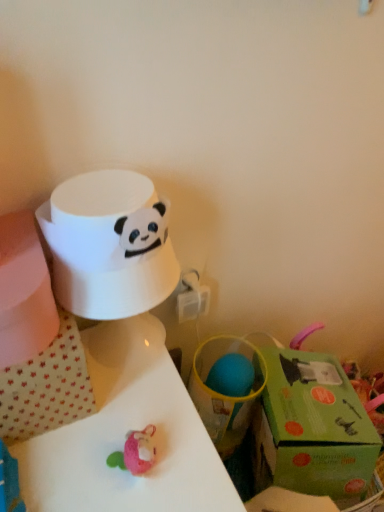
Locate an element on the screen. green cardboard gift box at lower right is located at coordinates (312, 428).

The height and width of the screenshot is (512, 384). What do you see at coordinates (109, 244) in the screenshot?
I see `white matte paper towel at upper left` at bounding box center [109, 244].

Where is `white glossy table at center`? white glossy table at center is located at coordinates (125, 434).

Identify the location of green cardboard gift box at lower right. (x=312, y=428).

Is green cardboard gift box at lower right oriented towards white matte paper towel at upper left?

No, green cardboard gift box at lower right is not oriented towards white matte paper towel at upper left.

Is point (279, 375) positioned in front of point (121, 273)?

That is False.

Does green cardboard gift box at lower right touch white matte paper towel at upper left?

There is a gap between green cardboard gift box at lower right and white matte paper towel at upper left.

Which object is positioned more to the right, green cardboard gift box at lower right or white matte paper towel at upper left?

green cardboard gift box at lower right.

Can you confirm if white glossy table at center is bigger than green cardboard gift box at lower right?

Yes.

From the image's perspective, is white glossy table at center beneath green cardboard gift box at lower right?

Yes, from the image's perspective, white glossy table at center is below green cardboard gift box at lower right.

Can you tell me how much white glossy table at center and green cardboard gift box at lower right differ in facing direction?

They differ by 25.6 degrees in their facing directions.

Is green cardboard gift box at lower right at the back of white glossy table at center?

white glossy table at center is not turned away from green cardboard gift box at lower right.

Is point (128, 191) in front of point (320, 370)?

Yes, point (128, 191) is closer to viewer.

Considering the relative positions of white matte paper towel at upper left and green cardboard gift box at lower right in the image provided, is white matte paper towel at upper left to the right of green cardboard gift box at lower right from the viewer's perspective?

In fact, white matte paper towel at upper left is to the left of green cardboard gift box at lower right.

Is white matte paper towel at upper left further to camera compared to green cardboard gift box at lower right?

No, white matte paper towel at upper left is closer to the camera.

From the image's perspective, relative to green cardboard gift box at lower right, is white matte paper towel at upper left above or below?

From the image's perspective, white matte paper towel at upper left appears above green cardboard gift box at lower right.

Considering the positions of objects green cardboard gift box at lower right and white glossy table at center in the image provided, who is in front, green cardboard gift box at lower right or white glossy table at center?

white glossy table at center is in front.

Does green cardboard gift box at lower right appear on the left side of white glossy table at center?

No.

Is green cardboard gift box at lower right oriented away from white glossy table at center?

No, white glossy table at center is not at the back of green cardboard gift box at lower right.

How different are the orientations of green cardboard gift box at lower right and white glossy table at center in degrees?

The angle between the facing direction of green cardboard gift box at lower right and the facing direction of white glossy table at center is 25.6 degrees.

Is white glossy table at center shorter than white matte paper towel at upper left?

In fact, white glossy table at center may be taller than white matte paper towel at upper left.

Considering the relative sizes of white glossy table at center and white matte paper towel at upper left in the image provided, is white glossy table at center bigger than white matte paper towel at upper left?

Indeed, white glossy table at center has a larger size compared to white matte paper towel at upper left.

Consider the image. Would you say white glossy table at center is outside white matte paper towel at upper left?

Yes, white glossy table at center is located beyond the bounds of white matte paper towel at upper left.

Is white glossy table at center placed right next to white matte paper towel at upper left?

No, white glossy table at center is not touching white matte paper towel at upper left.

How distant is white matte paper towel at upper left from white glossy table at center?

They are 7.40 inches apart.

Does white matte paper towel at upper left come in front of white glossy table at center?

That is False.

From the image's perspective, is white matte paper towel at upper left above white glossy table at center?

Yes, from the image's perspective, white matte paper towel at upper left is on top of white glossy table at center.

From a real-world perspective, who is located lower, white matte paper towel at upper left or white glossy table at center?

From a 3D spatial view, white glossy table at center is below.

The image size is (384, 512). There is a green cardboard gift box at lower right. Find the location of `paper towel above it (from a real-world perspective)`. paper towel above it (from a real-world perspective) is located at coordinates (109, 244).

In the image, there is a green cardboard gift box at lower right. Find the location of `table below it (from the image's perspective)`. table below it (from the image's perspective) is located at coordinates (125, 434).

Based on their spatial positions, is white matte paper towel at upper left or green cardboard gift box at lower right closer to white glossy table at center?

white matte paper towel at upper left lies closer to white glossy table at center than the other object.

Based on their spatial positions, is green cardboard gift box at lower right or white glossy table at center closer to white matte paper towel at upper left?

The object closer to white matte paper towel at upper left is white glossy table at center.

Which object lies further to the anchor point green cardboard gift box at lower right, white glossy table at center or white matte paper towel at upper left?

white matte paper towel at upper left lies further to green cardboard gift box at lower right than the other object.

Estimate the real-world distances between objects in this image. Which object is closer to white matte paper towel at upper left, white glossy table at center or green cardboard gift box at lower right?

white glossy table at center is positioned closer to the anchor white matte paper towel at upper left.

When comparing their distances from white glossy table at center, does green cardboard gift box at lower right or white matte paper towel at upper left seem closer?

white matte paper towel at upper left is positioned closer to the anchor white glossy table at center.

When comparing their distances from green cardboard gift box at lower right, does white matte paper towel at upper left or white glossy table at center seem closer?

Among the two, white glossy table at center is located nearer to green cardboard gift box at lower right.

At what (x,y) coordinates should I click in order to perform the action: click on gift box between white matte paper towel at upper left and white glossy table at center vertically. Please return your answer as a coordinate pair (x, y). The height and width of the screenshot is (512, 384). Looking at the image, I should click on (312, 428).